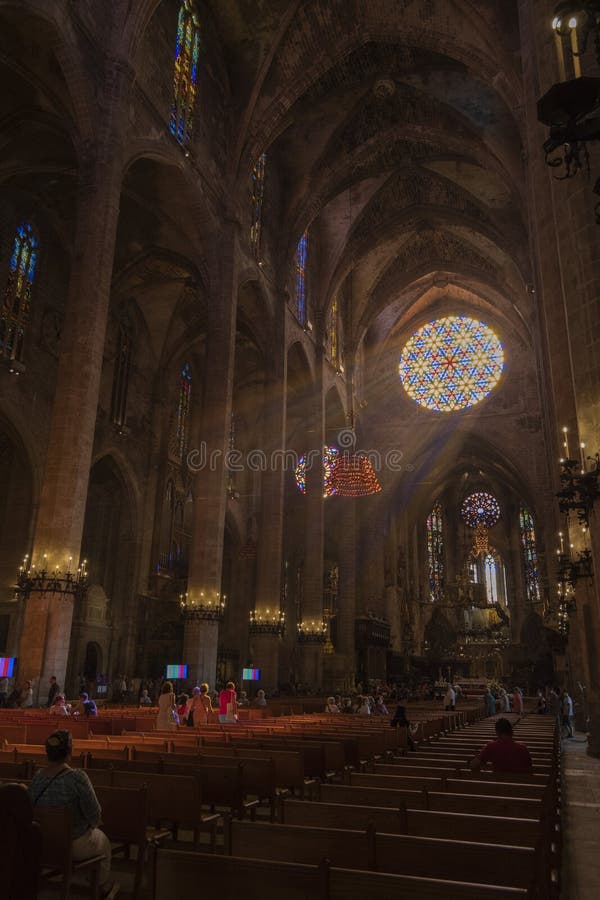
Where is `columns`? columns is located at coordinates (80, 424), (192, 536), (277, 543), (312, 546), (345, 597), (378, 563).